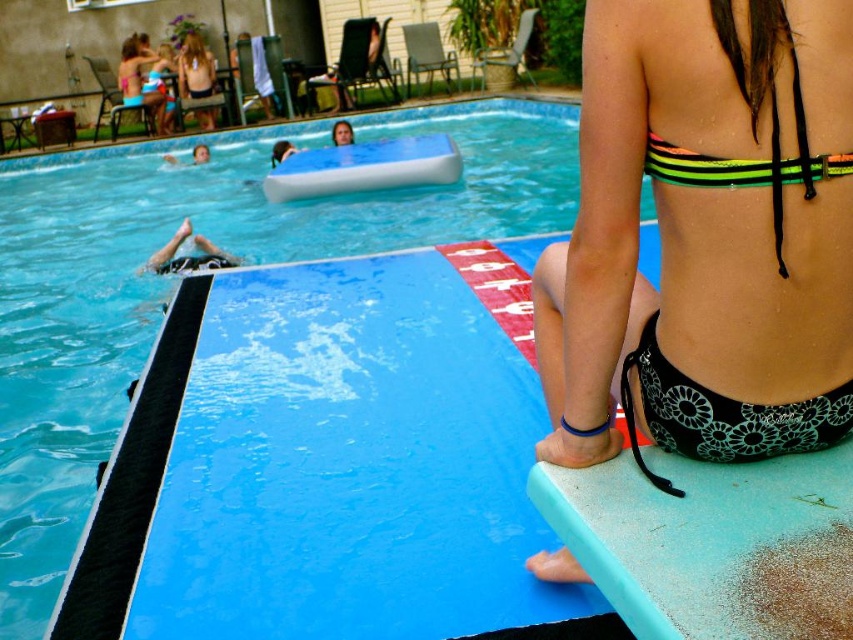
Can you confirm if blue rubber pool at upper center is bigger than black floral bikini at lower right?

Correct, blue rubber pool at upper center is larger in size than black floral bikini at lower right.

Where is `blue rubber pool at upper center`? The image size is (853, 640). blue rubber pool at upper center is located at coordinates (173, 284).

Is point (195, 212) closer to camera compared to point (631, 404)?

No, (195, 212) is behind (631, 404).

Find the location of a particular element. blue rubber pool at upper center is located at coordinates (173, 284).

Does neon green bikini top at upper right have a larger size compared to black floral bikini at lower right?

Yes, neon green bikini top at upper right is bigger than black floral bikini at lower right.

Who is higher up, neon green bikini top at upper right or black floral bikini at lower right?

neon green bikini top at upper right

Which is in front, point (807, 33) or point (654, 308)?

Point (807, 33)

Identify the location of neon green bikini top at upper right. The width and height of the screenshot is (853, 640). (706, 234).

Can you confirm if neon green bikini top at upper right is bigger than blue rubber pool at upper center?

No.

Can you confirm if neon green bikini top at upper right is wider than blue rubber pool at upper center?

In fact, neon green bikini top at upper right might be narrower than blue rubber pool at upper center.

Which is in front, point (614, 51) or point (535, 224)?

Positioned in front is point (614, 51).

The width and height of the screenshot is (853, 640). I want to click on neon green bikini top at upper right, so click(x=706, y=234).